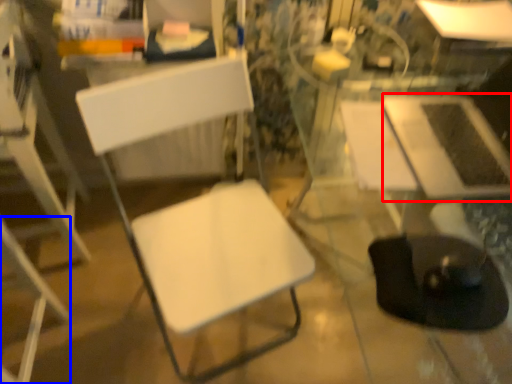
Question: Among these objects, which one is nearest to the camera, table (highlighted by a red box) or chair (highlighted by a blue box)?

Choices:
 (A) table
 (B) chair

Answer: (B)